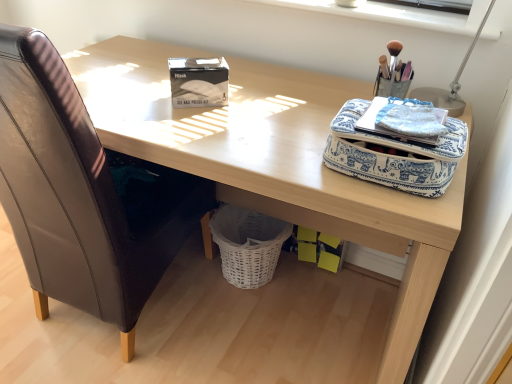
The height and width of the screenshot is (384, 512). I want to click on blue printed fabric bag at upper right, so click(x=394, y=154).

You are a GUI agent. You are given a task and a screenshot of the screen. Output one action in this format:
    pyautogui.click(x=<x>, y=<y>)
    Task: Click on the brown leather chair at left
    Image resolution: width=512 pixels, height=384 pixels.
    Given the screenshot: What is the action you would take?
    pyautogui.click(x=83, y=194)

The width and height of the screenshot is (512, 384). What do you see at coordinates (83, 194) in the screenshot? I see `brown leather chair at left` at bounding box center [83, 194].

I want to click on white plastic at upper center, so click(396, 14).

The height and width of the screenshot is (384, 512). Describe the element at coordinates (248, 244) in the screenshot. I see `white wicker basket at lower center` at that location.

From the picture: What is the approximate width of white matte gel nail polish kit at upper center?

2.54 inches.

Where is `wooden desk at center`? The width and height of the screenshot is (512, 384). wooden desk at center is located at coordinates (274, 162).

Who is shorter, brown leather chair at left or white matte gel nail polish kit at upper center?

white matte gel nail polish kit at upper center.

Is brown leather chair at left inside the boundaries of white matte gel nail polish kit at upper center, or outside?

brown leather chair at left is outside white matte gel nail polish kit at upper center.

Can you see brown leather chair at left touching white matte gel nail polish kit at upper center?

No, brown leather chair at left is not next to white matte gel nail polish kit at upper center.

Is metallic silver table lamp at upper right touching blue printed fabric bag at upper right?

There is a gap between metallic silver table lamp at upper right and blue printed fabric bag at upper right.

Is metallic silver table lamp at upper right not inside blue printed fabric bag at upper right?

That's correct, metallic silver table lamp at upper right is outside of blue printed fabric bag at upper right.

Does metallic silver table lamp at upper right have a lesser height compared to blue printed fabric bag at upper right?

No.

From the image's perspective, which is above, metallic silver table lamp at upper right or blue printed fabric bag at upper right?

metallic silver table lamp at upper right is shown above in the image.

Is white wicker basket at lower center looking in the opposite direction of wooden desk at center?

That's right, white wicker basket at lower center is facing away from wooden desk at center.

From the picture: Which of these two, white wicker basket at lower center or wooden desk at center, is thinner?

white wicker basket at lower center.

Considering the relative positions of white wicker basket at lower center and wooden desk at center in the image provided, is white wicker basket at lower center in front of wooden desk at center?

No, it is not.

From a real-world perspective, is white wicker basket at lower center above or below wooden desk at center?

In terms of real-world spatial position, white wicker basket at lower center is below wooden desk at center.

Is white matte gel nail polish kit at upper center oriented towards metallic silver table lamp at upper right?

No, white matte gel nail polish kit at upper center is not aimed at metallic silver table lamp at upper right.

In the image, is white matte gel nail polish kit at upper center on the left side or the right side of metallic silver table lamp at upper right?

Based on their positions, white matte gel nail polish kit at upper center is located to the left of metallic silver table lamp at upper right.

Is the depth of white matte gel nail polish kit at upper center less than that of metallic silver table lamp at upper right?

No, it is not.

Who is bigger, white matte gel nail polish kit at upper center or metallic silver table lamp at upper right?

metallic silver table lamp at upper right is bigger.

Considering the positions of points (402, 17) and (92, 298), is point (402, 17) farther from camera compared to point (92, 298)?

That is False.

Is white plastic at upper center in front of or behind brown leather chair at left in the image?

white plastic at upper center is positioned farther from the viewer than brown leather chair at left.

In terms of height, does white plastic at upper center look taller or shorter compared to brown leather chair at left?

In the image, white plastic at upper center appears to be shorter than brown leather chair at left.

From the image's perspective, is white plastic at upper center located above or below brown leather chair at left?

Based on their image positions, white plastic at upper center is located above brown leather chair at left.

Is the position of blue printed fabric bag at upper right less distant than that of wooden desk at center?

Yes, it is.

Is blue printed fabric bag at upper right taller than wooden desk at center?

Incorrect, the height of blue printed fabric bag at upper right is not larger of that of wooden desk at center.

From the image's perspective, is blue printed fabric bag at upper right on wooden desk at center?

Yes, from the image's perspective, blue printed fabric bag at upper right is over wooden desk at center.

Are blue printed fabric bag at upper right and wooden desk at center located far from each other?

No, blue printed fabric bag at upper right is not far from wooden desk at center.

Which of these two, wooden desk at center or white plastic at upper center, is thinner?

With smaller width is white plastic at upper center.

How many degrees apart are the facing directions of wooden desk at center and white plastic at upper center?

2.03 degrees separate the facing orientations of wooden desk at center and white plastic at upper center.

Does wooden desk at center appear on the left side of white plastic at upper center?

Yes, wooden desk at center is to the left of white plastic at upper center.

I want to click on desk in front of the white plastic at upper center, so click(274, 162).

At what (x,y) coordinates should I click in order to perform the action: click on box located on the right of brown leather chair at left. Please return your answer as a coordinate pair (x, y). The height and width of the screenshot is (384, 512). Looking at the image, I should click on (198, 82).

In order to click on table lamp behind the blue printed fabric bag at upper right in this screenshot , I will do `click(451, 82)`.

Estimate the real-world distances between objects in this image. Which object is closer to blue printed fabric bag at upper right, metallic silver table lamp at upper right or white matte gel nail polish kit at upper center?

metallic silver table lamp at upper right.

Based on their spatial positions, is metallic silver table lamp at upper right or white plastic at upper center further from brown leather chair at left?

Among the two, metallic silver table lamp at upper right is located further to brown leather chair at left.

Which object lies further to the anchor point white wicker basket at lower center, wooden desk at center or metallic silver table lamp at upper right?

Among the two, metallic silver table lamp at upper right is located further to white wicker basket at lower center.

Based on their spatial positions, is brown leather chair at left or blue printed fabric bag at upper right closer to metallic silver table lamp at upper right?

Among the two, blue printed fabric bag at upper right is located nearer to metallic silver table lamp at upper right.

Based on their spatial positions, is wooden desk at center or brown leather chair at left closer to metallic silver table lamp at upper right?

Among the two, wooden desk at center is located nearer to metallic silver table lamp at upper right.

From the image, which object appears to be nearer to white wicker basket at lower center, white matte gel nail polish kit at upper center or blue printed fabric bag at upper right?

The object closer to white wicker basket at lower center is white matte gel nail polish kit at upper center.

When comparing their distances from white matte gel nail polish kit at upper center, does wooden desk at center or blue printed fabric bag at upper right seem further?

blue printed fabric bag at upper right.

Which object lies further to the anchor point white wicker basket at lower center, blue printed fabric bag at upper right or wooden desk at center?

Based on the image, blue printed fabric bag at upper right appears to be further to white wicker basket at lower center.

This screenshot has height=384, width=512. Identify the location of desk located between brown leather chair at left and metallic silver table lamp at upper right in the left-right direction. (274, 162).

Locate an element on the screen. The width and height of the screenshot is (512, 384). bag located between brown leather chair at left and white wicker basket at lower center in the depth direction is located at coordinates (394, 154).

Identify the location of box between blue printed fabric bag at upper right and white wicker basket at lower center in the front-back direction. (198, 82).

You are a GUI agent. You are given a task and a screenshot of the screen. Output one action in this format:
    pyautogui.click(x=<x>, y=<y>)
    Task: Click on the basket between brown leather chair at left and metallic silver table lamp at upper right
    This screenshot has height=384, width=512.
    Given the screenshot: What is the action you would take?
    pyautogui.click(x=248, y=244)